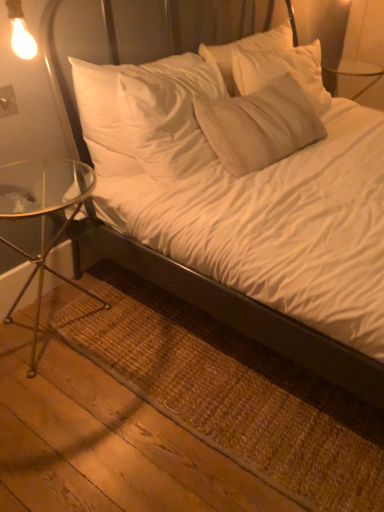
Question: From a real-world perspective, is brown woven mat at lower left beneath white soft bed at center?

Choices:
 (A) yes
 (B) no

Answer: (A)

Question: Are brown woven mat at lower left and white soft bed at center making contact?

Choices:
 (A) yes
 (B) no

Answer: (B)

Question: Could you tell me if brown woven mat at lower left is turned towards white soft bed at center?

Choices:
 (A) yes
 (B) no

Answer: (B)

Question: Considering the relative sizes of brown woven mat at lower left and white soft bed at center in the image provided, is brown woven mat at lower left smaller than white soft bed at center?

Choices:
 (A) yes
 (B) no

Answer: (A)

Question: Is brown woven mat at lower left looking in the opposite direction of white soft bed at center?

Choices:
 (A) yes
 (B) no

Answer: (B)

Question: Considering the positions of point (326, 446) and point (205, 300), is point (326, 446) closer or farther from the camera than point (205, 300)?

Choices:
 (A) closer
 (B) farther

Answer: (A)

Question: In terms of width, does brown woven mat at lower left look wider or thinner when compared to white soft bed at center?

Choices:
 (A) wide
 (B) thin

Answer: (B)

Question: Considering the positions of brown woven mat at lower left and white soft bed at center in the image, is brown woven mat at lower left taller or shorter than white soft bed at center?

Choices:
 (A) short
 (B) tall

Answer: (A)

Question: Relative to white soft bed at center, is brown woven mat at lower left in front or behind?

Choices:
 (A) behind
 (B) front

Answer: (A)

Question: From the image's perspective, is white soft bed at center above or below clear glass table at left?

Choices:
 (A) above
 (B) below

Answer: (A)

Question: Does point (243, 328) appear closer or farther from the camera than point (39, 296)?

Choices:
 (A) closer
 (B) farther

Answer: (A)

Question: From a real-world perspective, relative to clear glass table at left, is white soft bed at center vertically above or below?

Choices:
 (A) above
 (B) below

Answer: (A)

Question: In the image, is white soft bed at center on the left side or the right side of clear glass table at left?

Choices:
 (A) left
 (B) right

Answer: (B)

Question: Would you say white soft bed at center is to the left or to the right of brown woven mat at lower left in the picture?

Choices:
 (A) left
 (B) right

Answer: (B)

Question: From a real-world perspective, is white soft bed at center positioned above or below brown woven mat at lower left?

Choices:
 (A) below
 (B) above

Answer: (B)